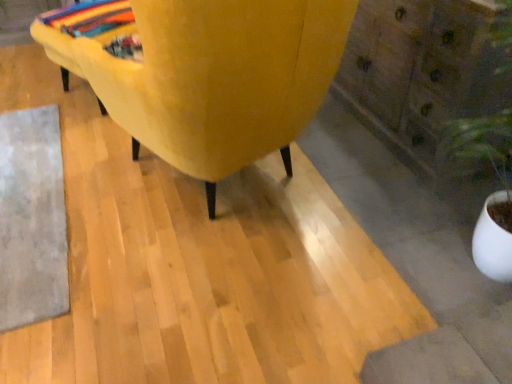
Question: Considering the relative sizes of gray woolen mat at lower left and velvet yellow chair at center in the image provided, is gray woolen mat at lower left wider than velvet yellow chair at center?

Choices:
 (A) yes
 (B) no

Answer: (B)

Question: Does gray woolen mat at lower left have a lesser height compared to velvet yellow chair at center?

Choices:
 (A) no
 (B) yes

Answer: (B)

Question: Does gray woolen mat at lower left have a larger size compared to velvet yellow chair at center?

Choices:
 (A) no
 (B) yes

Answer: (A)

Question: Considering the relative sizes of gray woolen mat at lower left and velvet yellow chair at center in the image provided, is gray woolen mat at lower left taller than velvet yellow chair at center?

Choices:
 (A) no
 (B) yes

Answer: (A)

Question: Is the position of gray woolen mat at lower left less distant than that of velvet yellow chair at center?

Choices:
 (A) no
 (B) yes

Answer: (A)

Question: Are gray woolen mat at lower left and velvet yellow chair at center located far from each other?

Choices:
 (A) no
 (B) yes

Answer: (A)

Question: Does gray woolen mat at lower left have a larger size compared to multicolored woven blanket at upper left?

Choices:
 (A) no
 (B) yes

Answer: (B)

Question: Is gray woolen mat at lower left facing away from multicolored woven blanket at upper left?

Choices:
 (A) no
 (B) yes

Answer: (A)

Question: Could you tell me if gray woolen mat at lower left is turned towards multicolored woven blanket at upper left?

Choices:
 (A) no
 (B) yes

Answer: (A)

Question: Does gray woolen mat at lower left contain multicolored woven blanket at upper left?

Choices:
 (A) yes
 (B) no

Answer: (B)

Question: Is gray woolen mat at lower left next to multicolored woven blanket at upper left and touching it?

Choices:
 (A) no
 (B) yes

Answer: (A)

Question: From a real-world perspective, is gray woolen mat at lower left physically below multicolored woven blanket at upper left?

Choices:
 (A) no
 (B) yes

Answer: (B)

Question: Can you confirm if velvet yellow chair at center is positioned to the right of multicolored woven blanket at upper left?

Choices:
 (A) yes
 (B) no

Answer: (A)